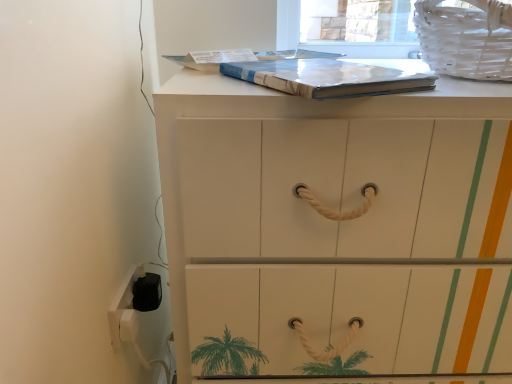
Question: From a real-world perspective, is white wicker laundry basket at upper right located beneath matte blue paperback book at upper center?

Choices:
 (A) yes
 (B) no

Answer: (B)

Question: Can you confirm if white wicker laundry basket at upper right is bigger than matte blue paperback book at upper center?

Choices:
 (A) no
 (B) yes

Answer: (B)

Question: Does white wicker laundry basket at upper right appear on the right side of matte blue paperback book at upper center?

Choices:
 (A) no
 (B) yes

Answer: (B)

Question: From the image's perspective, is white wicker laundry basket at upper right below matte blue paperback book at upper center?

Choices:
 (A) no
 (B) yes

Answer: (A)

Question: Is white wicker laundry basket at upper right not close to matte blue paperback book at upper center?

Choices:
 (A) yes
 (B) no

Answer: (B)

Question: Is white wicker laundry basket at upper right wider than matte blue paperback book at upper center?

Choices:
 (A) no
 (B) yes

Answer: (B)

Question: From the image's perspective, is white plastic electric outlet at lower left on white wicker laundry basket at upper right?

Choices:
 (A) no
 (B) yes

Answer: (A)

Question: Is white plastic electric outlet at lower left at the left side of white wicker laundry basket at upper right?

Choices:
 (A) no
 (B) yes

Answer: (B)

Question: Is white plastic electric outlet at lower left facing towards white wicker laundry basket at upper right?

Choices:
 (A) yes
 (B) no

Answer: (B)

Question: Does white plastic electric outlet at lower left have a larger size compared to white wicker laundry basket at upper right?

Choices:
 (A) no
 (B) yes

Answer: (A)

Question: From the image's perspective, is white plastic electric outlet at lower left under white wicker laundry basket at upper right?

Choices:
 (A) no
 (B) yes

Answer: (B)

Question: Is white plastic electric outlet at lower left completely or partially outside of white wicker laundry basket at upper right?

Choices:
 (A) no
 (B) yes

Answer: (B)

Question: Would you say matte blue paperback book at upper center is a long distance from white wicker laundry basket at upper right?

Choices:
 (A) yes
 (B) no

Answer: (B)